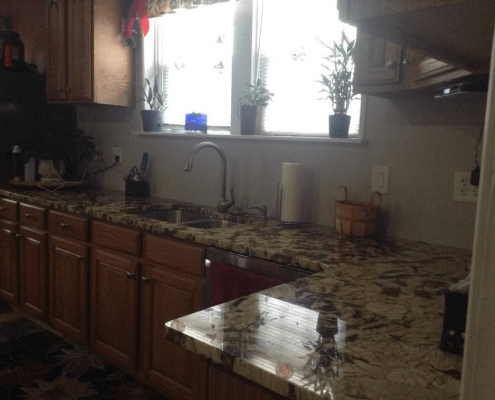
At what (x,y) coordinates should I click in order to perform the action: click on plant. Please return your answer as a coordinate pair (x, y). Image resolution: width=495 pixels, height=400 pixels. Looking at the image, I should click on (255, 91), (340, 87), (150, 101).